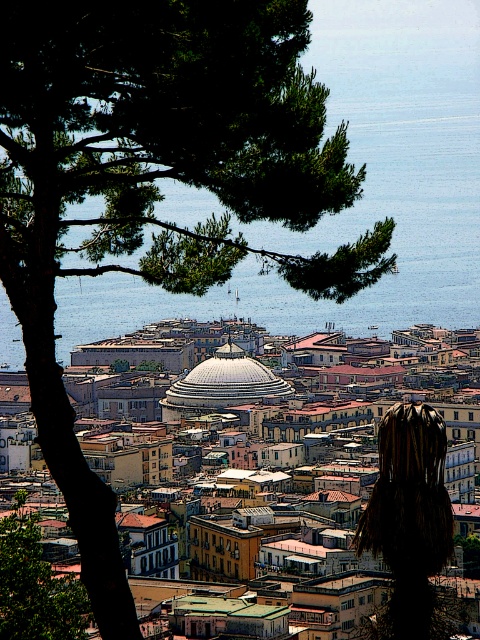
Is brown textured tree at center taller than green leafy tree at upper left?

Indeed, brown textured tree at center has a greater height compared to green leafy tree at upper left.

In the scene shown: Does brown textured tree at center have a lesser height compared to green leafy tree at upper left?

Incorrect, brown textured tree at center's height does not fall short of green leafy tree at upper left's.

Where is `brown textured tree at center`? brown textured tree at center is located at coordinates (409, 513).

Who is shorter, white dome at center or green leafy tree at upper left?

With less height is green leafy tree at upper left.

Consider the image. Is white dome at center thinner than green leafy tree at upper left?

No.

Is point (250, 380) positioned before point (13, 522)?

No, (250, 380) is behind (13, 522).

Where is `white dome at center`? white dome at center is located at coordinates (409, 509).

Is white dome at center further to the viewer compared to brown textured tree at center?

No.

Looking at this image, which of these two, white dome at center or brown textured tree at center, stands shorter?

With less height is brown textured tree at center.

The height and width of the screenshot is (640, 480). I want to click on white dome at center, so click(409, 509).